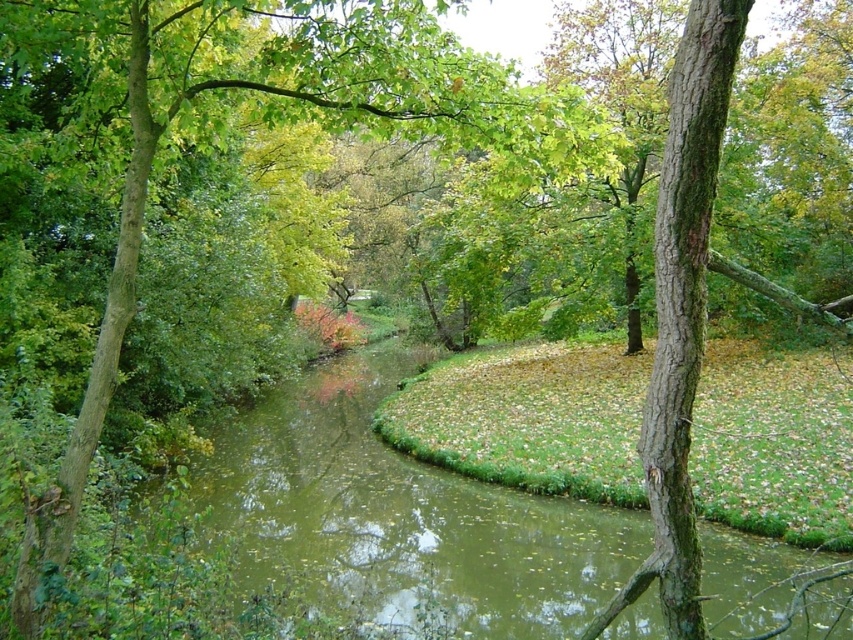
You are a photographer planning to capture the entire scene in one shot. Given that your camera can only focus on objects within a 100cm width, and the green murky water at center is wider than the green leafy tree at center, will you be able to fit both objects into your shot without cropping?

The green murky water at center is bigger than the green leafy tree at center, so if the combined width of both objects exceeds 100cm, they might not fit. However, since the description only states the water is larger but doesn

You are a hiker trying to cross the stream. The green leafy tree at center is blocking your path. Can you walk around it to reach the green murky water at center?

The green murky water at center is wider than the green leafy tree at center, so you can walk around the green leafy tree at center to reach the green murky water at center.

You are a hiker who wants to cross the stream. You see the green murky water at center and the green leafy tree at center. How far apart are these two landmarks?

The green murky water at center is 19.19 feet away from the green leafy tree at center.